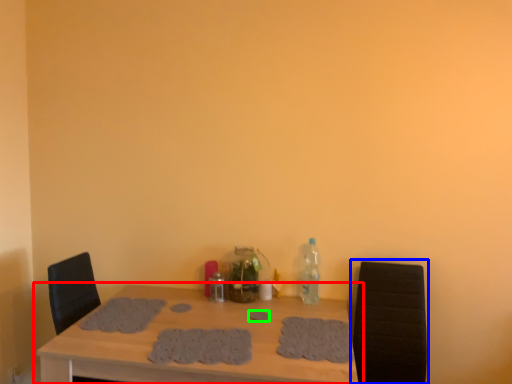
Question: Which is nearer to the table (highlighted by a red box)? armchair (highlighted by a blue box) or footprint (highlighted by a green box).

Choices:
 (A) armchair
 (B) footprint

Answer: (B)